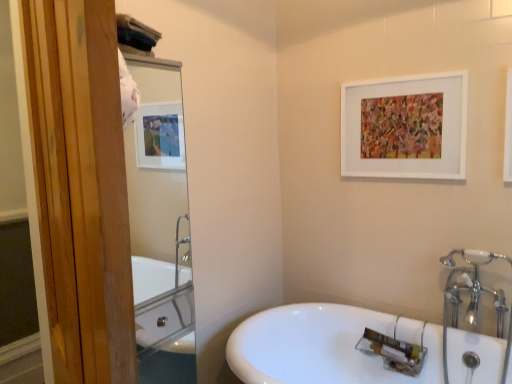
Question: In the image, is white glossy sink at lower center positioned in front of or behind clear glass mirror at upper left?

Choices:
 (A) front
 (B) behind

Answer: (A)

Question: Considering the relative positions of white glossy sink at lower center and clear glass mirror at upper left in the image provided, is white glossy sink at lower center to the left or to the right of clear glass mirror at upper left?

Choices:
 (A) right
 (B) left

Answer: (A)

Question: Estimate the real-world distances between objects in this image. Which object is farther from the white glossy sink at lower center?

Choices:
 (A) white ceramic faucet at upper right
 (B) clear glass mirror at upper left
 (C) white matte picture frame at upper center

Answer: (B)

Question: Which is farther from the white matte picture frame at upper center?

Choices:
 (A) clear glass mirror at upper left
 (B) white glossy sink at lower center
 (C) white ceramic faucet at upper right

Answer: (A)